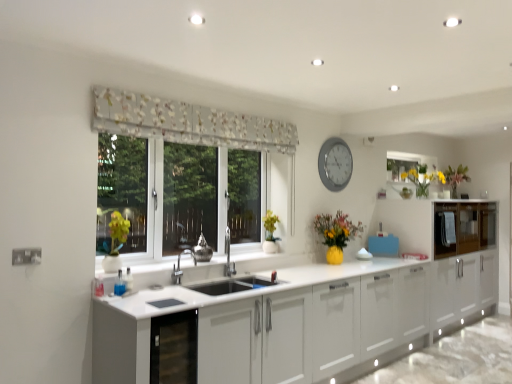
Question: In terms of height, does green matte plant at left look taller or shorter compared to floral fabric curtain at upper center?

Choices:
 (A) tall
 (B) short

Answer: (A)

Question: In the image, is green matte plant at left positioned in front of or behind floral fabric curtain at upper center?

Choices:
 (A) front
 (B) behind

Answer: (B)

Question: Estimate the real-world distances between objects in this image. Which object is farther from the floral fabric curtain at upper center?

Choices:
 (A) green matte plant at left
 (B) yellow glass vase at upper right
 (C) glossy wood cabinets at right
 (D) metallic silver vase at center
 (E) silver metallic clock at upper center

Answer: (B)

Question: Which object is the farthest from the green matte plant at left?

Choices:
 (A) yellow glass vase at upper right
 (B) floral fabric curtain at upper center
 (C) glossy wood cabinets at right
 (D) silver metallic clock at upper center
 (E) metallic silver vase at center

Answer: (C)